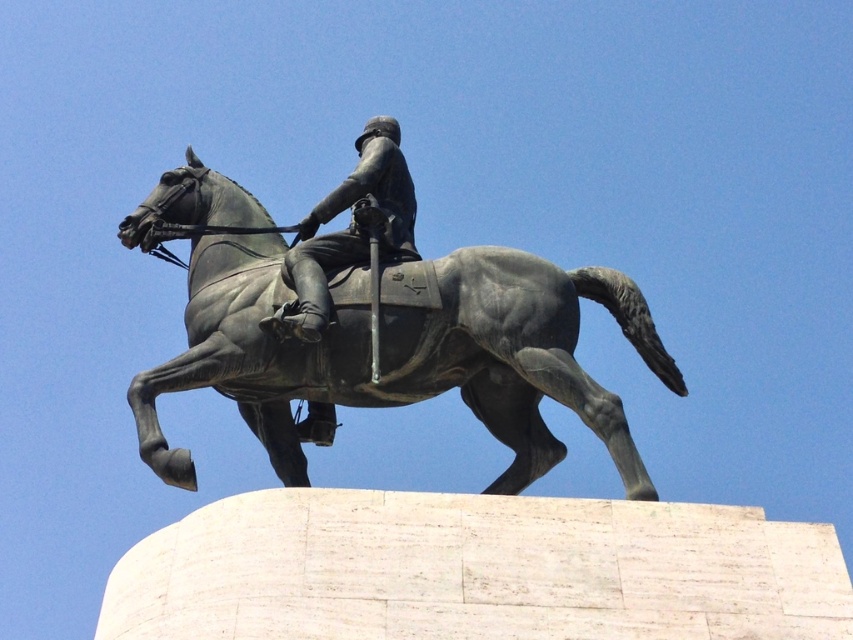
Question: Which object appears closest to the camera in this image?

Choices:
 (A) bronze statue at center
 (B) polished bronze helmet at center

Answer: (A)

Question: Which object appears closest to the camera in this image?

Choices:
 (A) polished bronze helmet at center
 (B) bronze statue at center

Answer: (B)

Question: Can you confirm if bronze statue at center is thinner than polished bronze helmet at center?

Choices:
 (A) no
 (B) yes

Answer: (A)

Question: Which point is closer to the camera?

Choices:
 (A) polished bronze helmet at center
 (B) bronze statue at center

Answer: (B)

Question: Does bronze statue at center have a lesser width compared to polished bronze helmet at center?

Choices:
 (A) yes
 (B) no

Answer: (B)

Question: Can you confirm if bronze statue at center is positioned below polished bronze helmet at center?

Choices:
 (A) yes
 (B) no

Answer: (A)